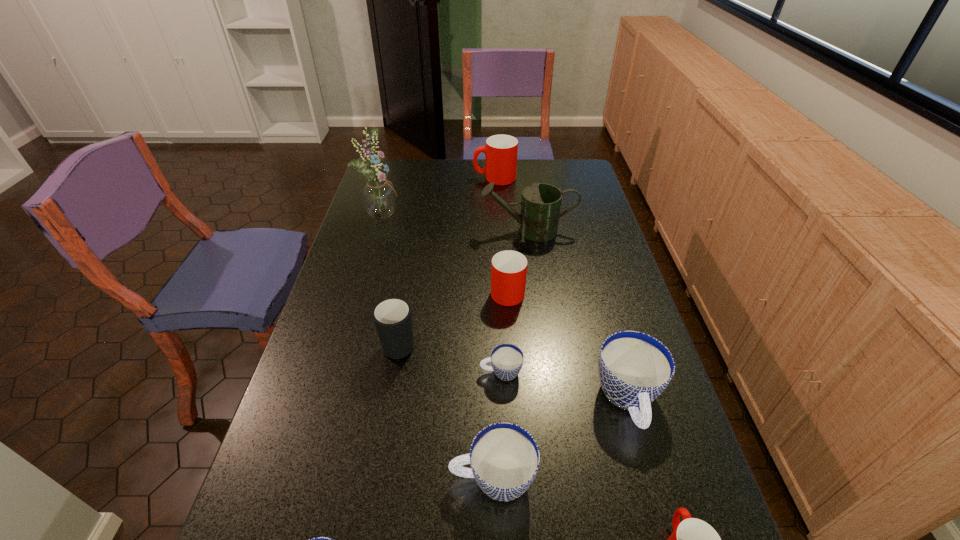
Where is `free region located on the side of the mug with the handle`? This screenshot has height=540, width=960. free region located on the side of the mug with the handle is located at coordinates (418, 239).

The width and height of the screenshot is (960, 540). I want to click on vacant space located on the side of the mug with the handle, so [405, 309].

This screenshot has height=540, width=960. In order to click on free region located on the side of the mug with the handle in this screenshot , I will do 409,286.

Image resolution: width=960 pixels, height=540 pixels. I want to click on free space located 0.360m on the side of the fourth farthest object with the handle, so click(x=502, y=211).

The image size is (960, 540). I want to click on free location located on the side of the fourth farthest object with the handle, so click(x=503, y=219).

Locate an element on the screen. The image size is (960, 540). blank area located 0.060m on the side of the fourth farthest object with the handle is located at coordinates (506, 262).

Where is `free space located on the side of the biggest blue cup with the handle`? This screenshot has height=540, width=960. free space located on the side of the biggest blue cup with the handle is located at coordinates (650, 478).

Locate an element on the screen. This screenshot has height=540, width=960. free region located 0.350m on the side of the third smallest blue cup with the handle is located at coordinates (283, 479).

Where is `vacant area situated on the side of the third smallest blue cup with the handle`? vacant area situated on the side of the third smallest blue cup with the handle is located at coordinates (274, 479).

Where is `free space located on the side of the third smallest blue cup with the handle`? The image size is (960, 540). free space located on the side of the third smallest blue cup with the handle is located at coordinates (412, 479).